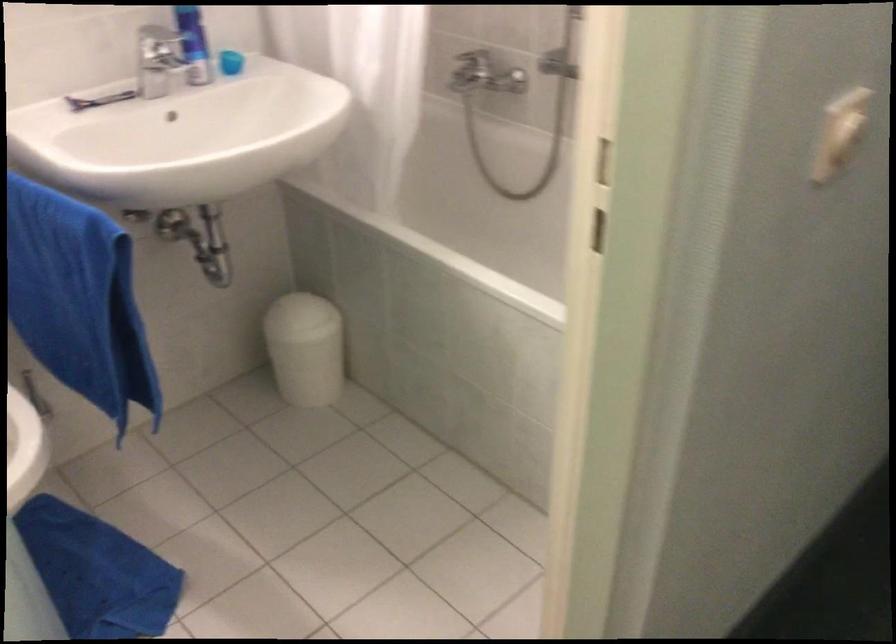
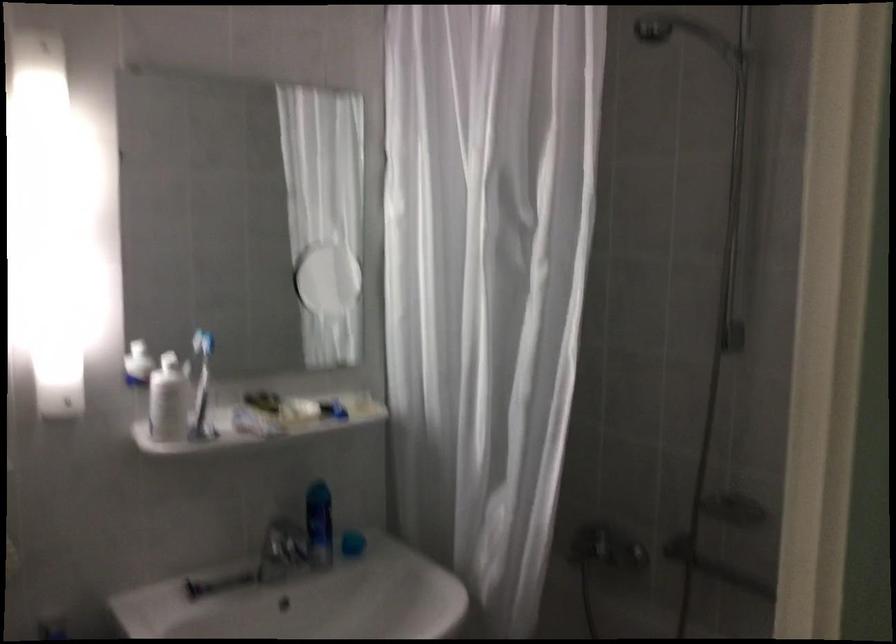
Question: What movement of the cameraman would produce the second image?

Choices:
 (A) Left
 (B) Right
 (C) Forward
 (D) Backward

Answer: (A)